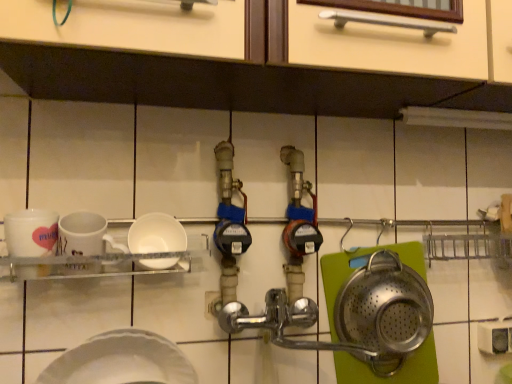
Question: From the image's perspective, would you say white glossy mug at left is shown under white matte bowl at center, the first plate when ordered from top to bottom?

Choices:
 (A) yes
 (B) no

Answer: (B)

Question: Is white glossy mug at left in contact with white matte bowl at center, which is the 2th plate from bottom to top?

Choices:
 (A) no
 (B) yes

Answer: (A)

Question: Considering the relative sizes of white glossy mug at left and white matte bowl at center, which is the 2th plate from bottom to top, in the image provided, is white glossy mug at left wider than white matte bowl at center, which is the 2th plate from bottom to top,?

Choices:
 (A) yes
 (B) no

Answer: (B)

Question: Would you say white glossy mug at left is a long distance from white matte bowl at center, the first plate when ordered from top to bottom?

Choices:
 (A) no
 (B) yes

Answer: (A)

Question: Can you confirm if white glossy mug at left is positioned to the left of white matte bowl at center, the first plate when ordered from top to bottom?

Choices:
 (A) no
 (B) yes

Answer: (B)

Question: From the image's perspective, is white glossy mug at left above or below white matte plate at lower left, the second plate in the top-to-bottom sequence?

Choices:
 (A) above
 (B) below

Answer: (A)

Question: In terms of height, does white glossy mug at left look taller or shorter compared to white matte plate at lower left, the second plate in the top-to-bottom sequence?

Choices:
 (A) tall
 (B) short

Answer: (A)

Question: Looking at their shapes, would you say white glossy mug at left is wider or thinner than white matte plate at lower left, the 1th plate in the bottom-to-top sequence?

Choices:
 (A) thin
 (B) wide

Answer: (A)

Question: Is white glossy mug at left in front of or behind white matte plate at lower left, the 1th plate in the bottom-to-top sequence, in the image?

Choices:
 (A) front
 (B) behind

Answer: (B)

Question: Based on their positions, is white matte plate at lower left, the 1th plate in the bottom-to-top sequence, located to the left or right of white matte bowl at center, which is the 2th plate from bottom to top?

Choices:
 (A) right
 (B) left

Answer: (B)

Question: Is white matte plate at lower left, the second plate in the top-to-bottom sequence, wider or thinner than white matte bowl at center, the first plate when ordered from top to bottom?

Choices:
 (A) wide
 (B) thin

Answer: (A)

Question: In terms of height, does white matte plate at lower left, the second plate in the top-to-bottom sequence, look taller or shorter compared to white matte bowl at center, which is the 2th plate from bottom to top?

Choices:
 (A) tall
 (B) short

Answer: (A)

Question: Considering their positions, is white matte plate at lower left, the second plate in the top-to-bottom sequence, located in front of or behind white matte bowl at center, the first plate when ordered from top to bottom?

Choices:
 (A) behind
 (B) front

Answer: (B)

Question: Is white matte plate at lower left, the 1th plate in the bottom-to-top sequence, wider or thinner than white glossy mug at left?

Choices:
 (A) wide
 (B) thin

Answer: (A)

Question: From a real-world perspective, relative to white glossy mug at left, is white matte plate at lower left, the second plate in the top-to-bottom sequence, vertically above or below?

Choices:
 (A) below
 (B) above

Answer: (A)